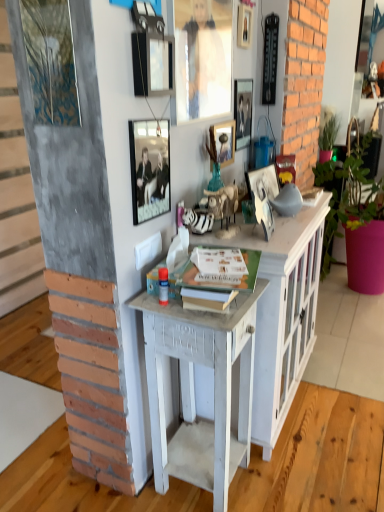
Question: Considering the relative sizes of white painted wood desk at center and metallic silver picture frame at upper center, marked as the second picture frame in a right-to-left arrangement, in the image provided, is white painted wood desk at center bigger than metallic silver picture frame at upper center, marked as the second picture frame in a right-to-left arrangement,?

Choices:
 (A) yes
 (B) no

Answer: (A)

Question: Is white painted wood desk at center taller than metallic silver picture frame at upper center, which is counted as the 6th picture frame, starting from the left?

Choices:
 (A) yes
 (B) no

Answer: (A)

Question: From a real-world perspective, is white painted wood desk at center physically below metallic silver picture frame at upper center, which is counted as the 6th picture frame, starting from the left?

Choices:
 (A) yes
 (B) no

Answer: (A)

Question: Considering the relative sizes of white painted wood desk at center and metallic silver picture frame at upper center, marked as the second picture frame in a right-to-left arrangement, in the image provided, is white painted wood desk at center smaller than metallic silver picture frame at upper center, marked as the second picture frame in a right-to-left arrangement,?

Choices:
 (A) no
 (B) yes

Answer: (A)

Question: Does white painted wood desk at center have a lesser width compared to metallic silver picture frame at upper center, marked as the second picture frame in a right-to-left arrangement?

Choices:
 (A) no
 (B) yes

Answer: (A)

Question: From the image's perspective, relative to metallic silver picture frame at upper center, the 7th picture frame when ordered from right to left, is matte glass picture frame at upper center, the 4th picture frame when ordered from right to left, above or below?

Choices:
 (A) below
 (B) above

Answer: (B)

Question: From a real-world perspective, is matte glass picture frame at upper center, which is the fourth picture frame from left to right, physically located above or below metallic silver picture frame at upper center, placed as the first picture frame when sorted from left to right?

Choices:
 (A) above
 (B) below

Answer: (A)

Question: Is matte glass picture frame at upper center, which is the fourth picture frame from left to right, taller or shorter than metallic silver picture frame at upper center, placed as the first picture frame when sorted from left to right?

Choices:
 (A) short
 (B) tall

Answer: (A)

Question: Is matte glass picture frame at upper center, which is the fourth picture frame from left to right, to the left or to the right of metallic silver picture frame at upper center, the 7th picture frame when ordered from right to left, in the image?

Choices:
 (A) left
 (B) right

Answer: (B)

Question: Considering the relative positions of white painted wood desk at center and matte glass picture frame at upper center, which is the fourth picture frame from left to right, in the image provided, is white painted wood desk at center to the left or to the right of matte glass picture frame at upper center, which is the fourth picture frame from left to right,?

Choices:
 (A) right
 (B) left

Answer: (B)

Question: Is point tap(218, 478) positioned closer to the camera than point tap(223, 156)?

Choices:
 (A) closer
 (B) farther

Answer: (A)

Question: Considering their positions, is white painted wood desk at center located in front of or behind matte glass picture frame at upper center, which is the fourth picture frame from left to right?

Choices:
 (A) behind
 (B) front

Answer: (B)

Question: Is white painted wood desk at center inside or outside of matte glass picture frame at upper center, which is the fourth picture frame from left to right?

Choices:
 (A) outside
 (B) inside

Answer: (A)

Question: From a real-world perspective, relative to matte glass picture frame at upper center, which is the fourth picture frame from left to right, is metallic silver picture frame at center, acting as the 1th picture frame starting from the right, vertically above or below?

Choices:
 (A) above
 (B) below

Answer: (B)

Question: Considering the positions of metallic silver picture frame at center, acting as the 1th picture frame starting from the right, and matte glass picture frame at upper center, which is the fourth picture frame from left to right, in the image, is metallic silver picture frame at center, acting as the 1th picture frame starting from the right, bigger or smaller than matte glass picture frame at upper center, which is the fourth picture frame from left to right,?

Choices:
 (A) small
 (B) big

Answer: (B)